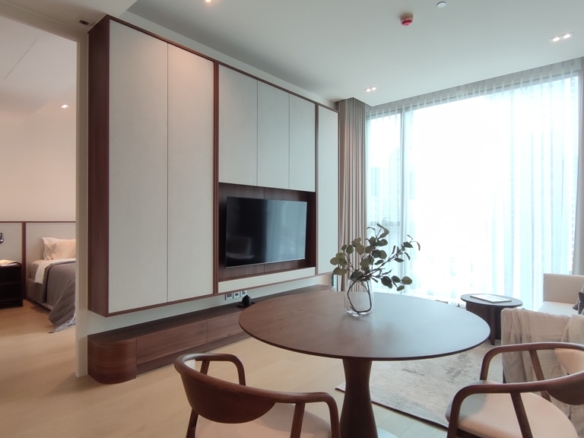
Identify the location of book. (492, 297).